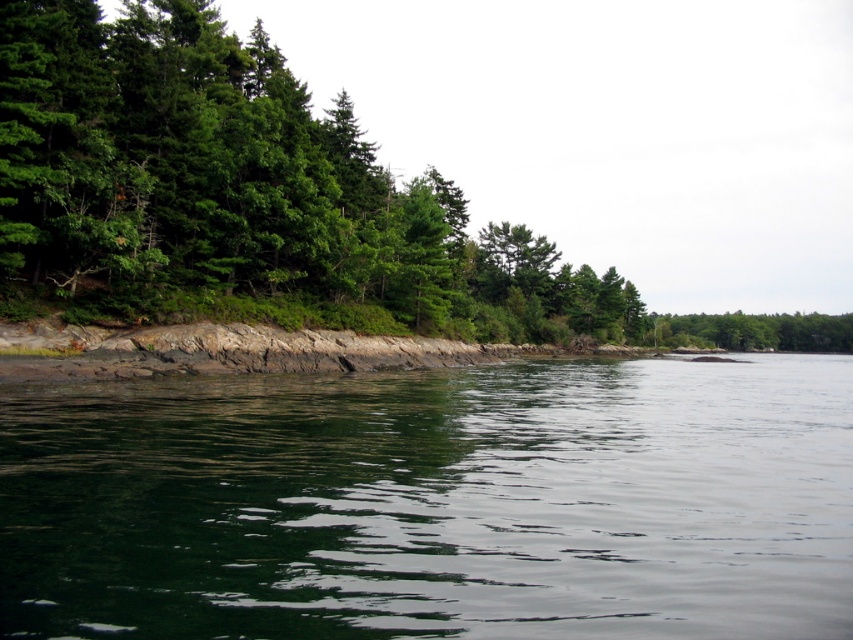
You are standing on the shoreline and want to take a photo of both the green reflective water at center and the green matte tree at center. Which object will appear closer to the camera in your photo?

The green reflective water at center will appear closer to the camera in your photo because it is positioned in front of the green matte tree at center according to the scene description.

You are standing on the rocky shore looking towards the water. You notice the green matte trees at left and the green matte tree at center. Which of these two objects is positioned higher in the image?

The green matte trees at left is located above the green matte tree at center, so it is positioned higher in the image.